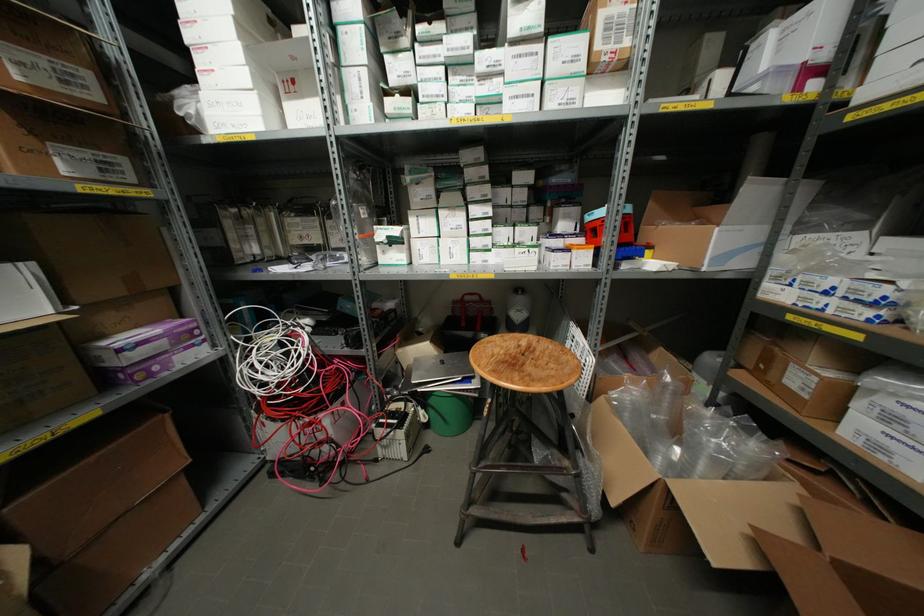
The height and width of the screenshot is (616, 924). What do you see at coordinates (525, 363) in the screenshot? I see `a chair sitting surface` at bounding box center [525, 363].